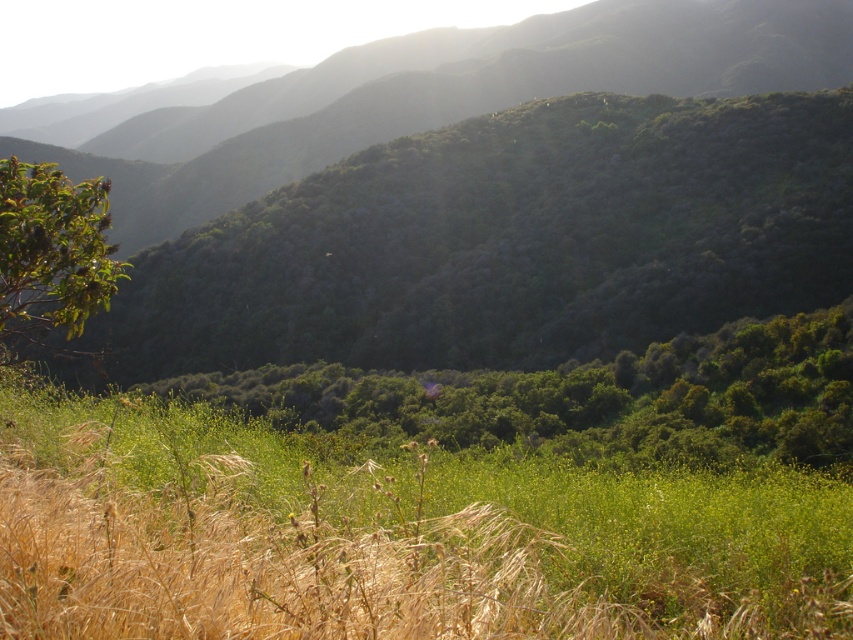
Question: Which point is farther to the camera?

Choices:
 (A) green grassy field at lower center
 (B) green leafy tree at left
 (C) green leafy tree at center
 (D) green leafy trees at center

Answer: (C)

Question: Among these points, which one is nearest to the camera?

Choices:
 (A) (219, 244)
 (B) (76, 205)
 (C) (403, 634)

Answer: (C)

Question: Does green grassy field at lower center appear over green leafy trees at center?

Choices:
 (A) yes
 (B) no

Answer: (A)

Question: Observing the image, what is the correct spatial positioning of green leafy tree at center in reference to green leafy trees at center?

Choices:
 (A) below
 (B) above

Answer: (B)

Question: Is green grassy field at lower center behind green leafy tree at left?

Choices:
 (A) yes
 (B) no

Answer: (B)

Question: Which object is farther from the camera taking this photo?

Choices:
 (A) green leafy tree at left
 (B) green leafy trees at center
 (C) green leafy tree at center
 (D) green grassy field at lower center

Answer: (C)